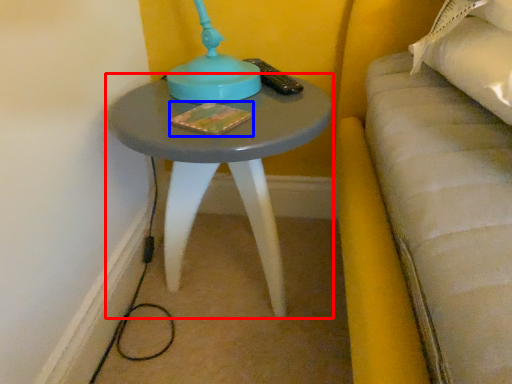
Question: Which of the following is the farthest to the observer, table (highlighted by a red box) or book (highlighted by a blue box)?

Choices:
 (A) table
 (B) book

Answer: (B)